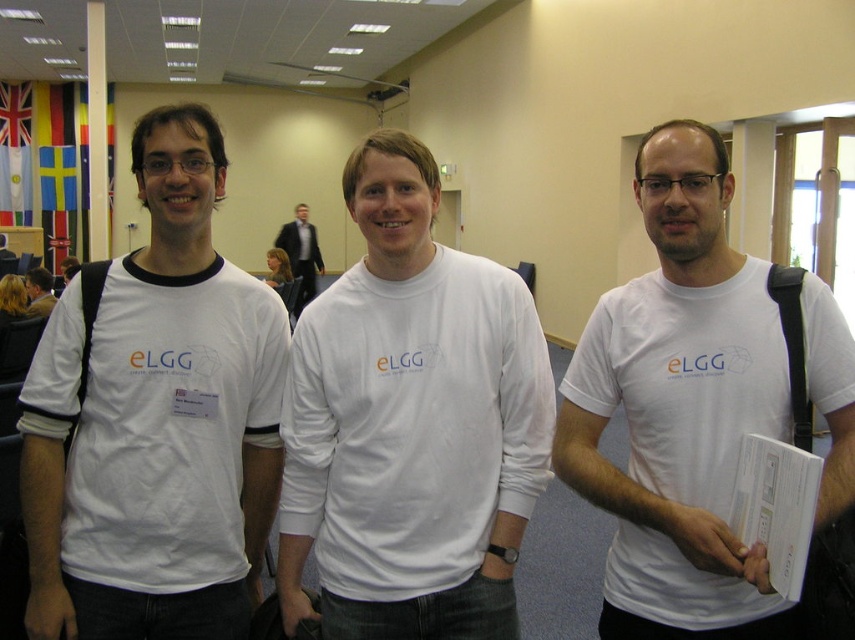
Question: Does black suit at center appear under matte white t-shirt at center?

Choices:
 (A) yes
 (B) no

Answer: (B)

Question: Does white paper folder at center appear over black suit at center?

Choices:
 (A) yes
 (B) no

Answer: (B)

Question: Which object appears closest to the camera in this image?

Choices:
 (A) white cotton t-shirt at center
 (B) white paper folder at center
 (C) black suit at center

Answer: (B)

Question: Which of the following is the closest to the observer?

Choices:
 (A) (502, 376)
 (B) (40, 304)
 (C) (299, 307)

Answer: (A)

Question: Which point is closer to the camera taking this photo?

Choices:
 (A) (x=27, y=275)
 (B) (x=739, y=518)

Answer: (B)

Question: Where is black suit at center located in relation to matte white t-shirt at center in the image?

Choices:
 (A) below
 (B) above

Answer: (B)